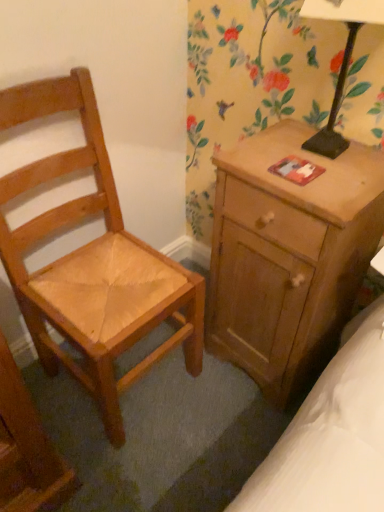
Question: Is black metal table lamp at upper right taller or shorter than wooden nightstand at right?

Choices:
 (A) short
 (B) tall

Answer: (A)

Question: From a real-world perspective, is black metal table lamp at upper right above or below wooden nightstand at right?

Choices:
 (A) below
 (B) above

Answer: (B)

Question: Which is farther from the light brown wooden chair at left?

Choices:
 (A) wooden nightstand at right
 (B) black metal table lamp at upper right

Answer: (B)

Question: Estimate the real-world distances between objects in this image. Which object is farther from the wooden nightstand at right?

Choices:
 (A) light brown wooden chair at left
 (B) black metal table lamp at upper right

Answer: (A)